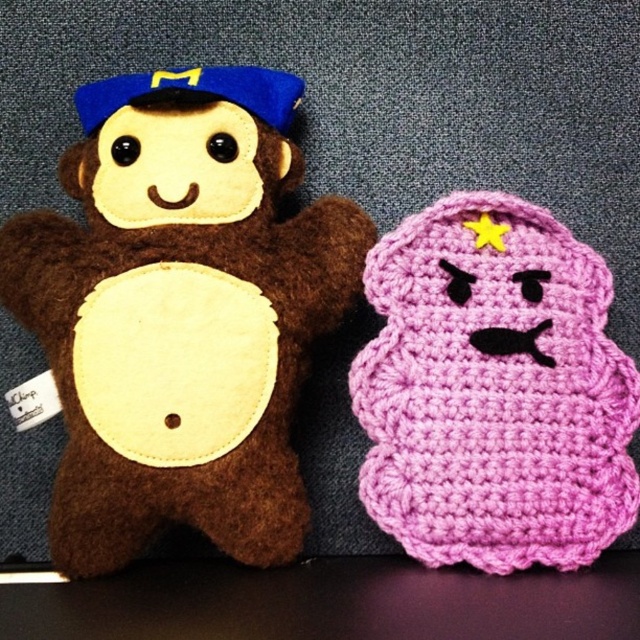
Is brown felt monkey at left closer to camera compared to crochet pink plush at right?

Yes, brown felt monkey at left is closer to the viewer.

Can you confirm if brown felt monkey at left is wider than crochet pink plush at right?

Yes.

Identify the location of brown felt monkey at left. (180, 312).